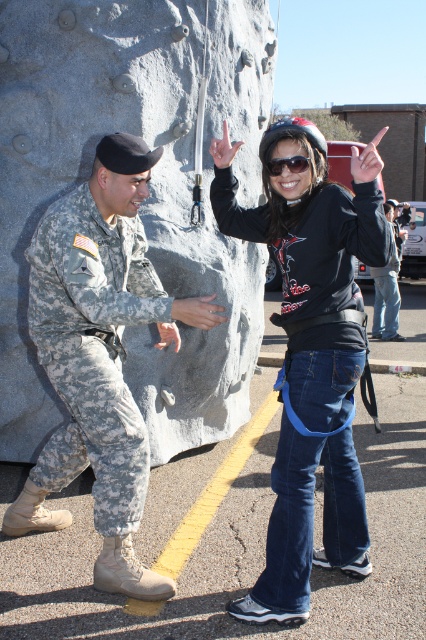
You are a photographer standing at the origin point of the coordinate system. You want to take a photo of the gray stone boulder at center. What are the coordinates where you should aim your camera?

The gray stone boulder at center is located at coordinates point (146, 198). So you should aim your camera at point (146, 198).

You are standing at the base of the artificial rock climbing wall and want to place a new climbing hold. The gray stone boulder at center is represented by point [146,198]. Where should you place the new hold relative to the gray stone boulder at center?

The gray stone boulder at center is located at point [146,198], so you should place the new hold near that coordinate to ensure it is positioned correctly relative to the existing boulder.

You are an observer standing in front of the artificial rock climbing wall. You notice two objects in the scene. One is the white matte finger at upper right and the other is the matte gray hand at center. Which object is positioned closer to you?

The white matte finger at upper right is closer to the viewer than the matte gray hand at center.